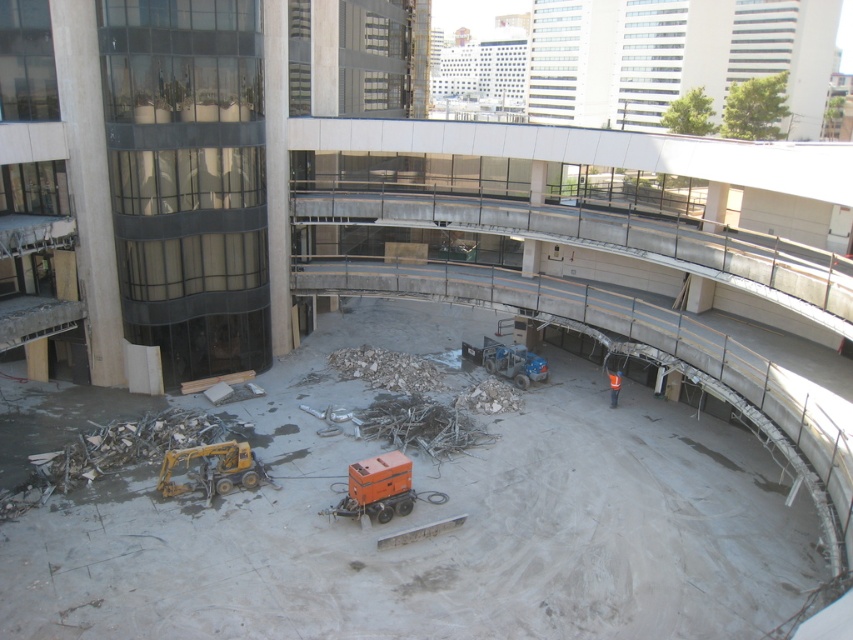
Question: Which point is closer to the camera?

Choices:
 (A) (352, 464)
 (B) (531, 358)
 (C) (186, 456)

Answer: (C)

Question: Is yellow metallic excavator at lower left to the right of orange reflective vest at center from the viewer's perspective?

Choices:
 (A) no
 (B) yes

Answer: (A)

Question: Is blue metallic truck at center to the left of orange reflective vest at center from the viewer's perspective?

Choices:
 (A) no
 (B) yes

Answer: (B)

Question: Is orange rubbermaid container at center to the right of yellow metallic excavator at lower left from the viewer's perspective?

Choices:
 (A) yes
 (B) no

Answer: (A)

Question: Which point appears farthest from the camera in this image?

Choices:
 (A) (393, 456)
 (B) (180, 451)
 (C) (610, 396)
 (D) (802, 556)

Answer: (C)

Question: Which object is positioned farthest from the yellow metallic excavator at lower left?

Choices:
 (A) orange reflective vest at center
 (B) orange rubbermaid container at center
 (C) concrete debris at center
 (D) blue metallic truck at center

Answer: (A)